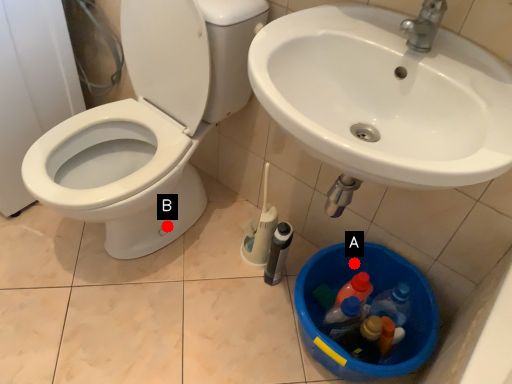
Question: Two points are circled on the image, labeled by A and B beside each circle. Among these points, which one is farthest from the camera?

Choices:
 (A) A is further
 (B) B is further

Answer: (B)